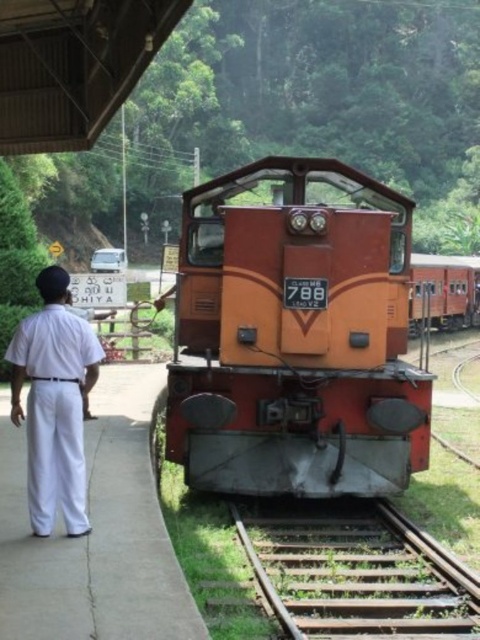
Between green grassy train track at center and orange matte train at center, which one is positioned lower?

green grassy train track at center is below.

Which is more to the right, green grassy train track at center or orange matte train at center?

orange matte train at center

Does point (402, 577) come closer to viewer compared to point (479, 282)?

Yes, point (402, 577) is closer to viewer.

At what (x,y) coordinates should I click in order to perform the action: click on green grassy train track at center. Please return your answer as a coordinate pair (x, y). Looking at the image, I should click on (x=358, y=576).

Image resolution: width=480 pixels, height=640 pixels. Describe the element at coordinates (358, 576) in the screenshot. I see `green grassy train track at center` at that location.

What are the coordinates of `green grassy train track at center` in the screenshot? It's located at (358, 576).

I want to click on green grassy train track at center, so click(358, 576).

The height and width of the screenshot is (640, 480). Find the location of `green grassy train track at center`. green grassy train track at center is located at coordinates (358, 576).

Who is taller, rusty metal train at center or orange matte train at center?

orange matte train at center

Can you confirm if rusty metal train at center is thinner than orange matte train at center?

Yes.

Locate an element on the screen. rusty metal train at center is located at coordinates (296, 336).

Find the location of a particular element. rusty metal train at center is located at coordinates pyautogui.click(x=296, y=336).